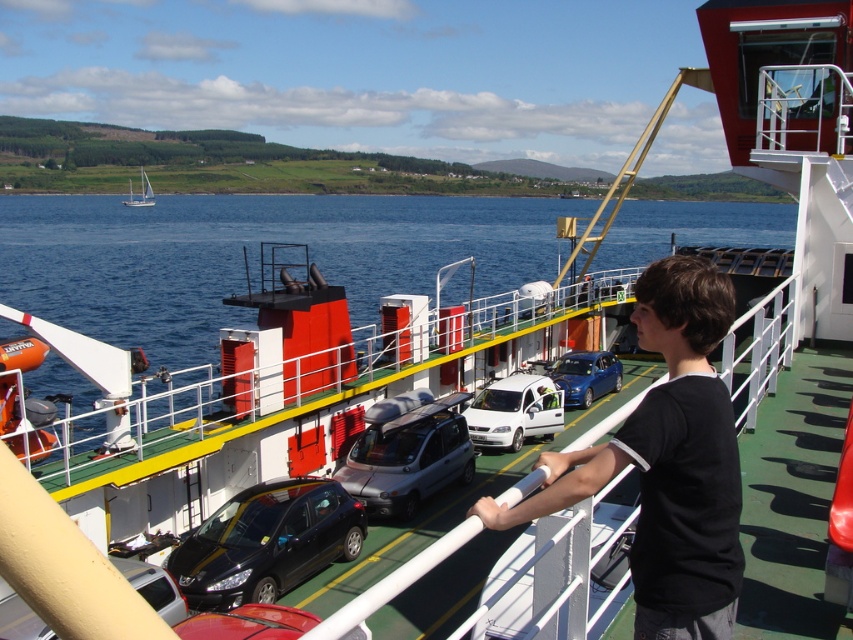
You are standing on the ferry deck and want to take a photo of the blue water at center. According to the coordinates provided, where should you aim your camera?

You should aim your camera at point 0.402 on the horizontal axis and 0.293 on the vertical axis to capture the blue water at center.

You are standing on the ferry deck and want to know the distance between the blue water at center and the silver metallic van at center. Can you estimate how far apart they are?

The blue water at center is 235.97 feet away from the silver metallic van at center.

Looking at this image, you are a passenger on the ferry and notice the black cotton shirt at center and the blue metallic car at center. Which object has a smaller width?

The black cotton shirt at center is thinner than the blue metallic car at center, so the black cotton shirt at center has a smaller width.